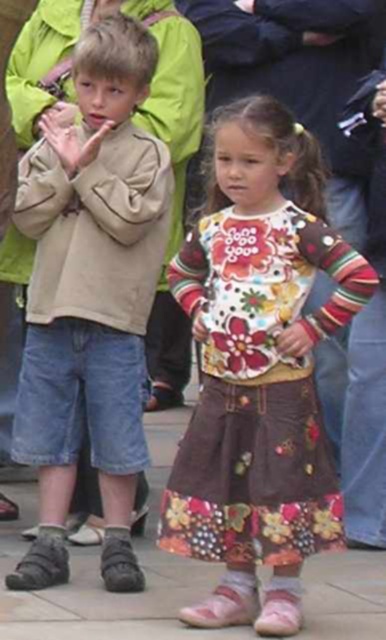
You are a photographer standing 10 feet away from both the light brown suede jacket at center and the floral cotton dress at center. Can you fit both subjects into your camera frame without moving closer or farther?

The distance between the light brown suede jacket at center and the floral cotton dress at center is 8.32 feet. Since you are 10 feet away from both, the total width needed to capture both would require a field of view that can cover at least 8.32 feet at 10 feet distance. Assuming standard camera angles, this is feasible as most cameras can capture such a width at that distance without needing to move closer.

You are a photographer trying to capture a candid shot of the two children in the scene. You notice two points of interest marked as point 1 at coordinates point (123, 212) and point 2 at coordinates point (225, 288). To ensure the subject with the closer point is in focus, which point should you prioritize focusing on?

Point 1 at coordinates point (123, 212) is closer to the viewer than point 2 at coordinates point (225, 288), so you should prioritize focusing on point 1 to ensure the subject is in focus.